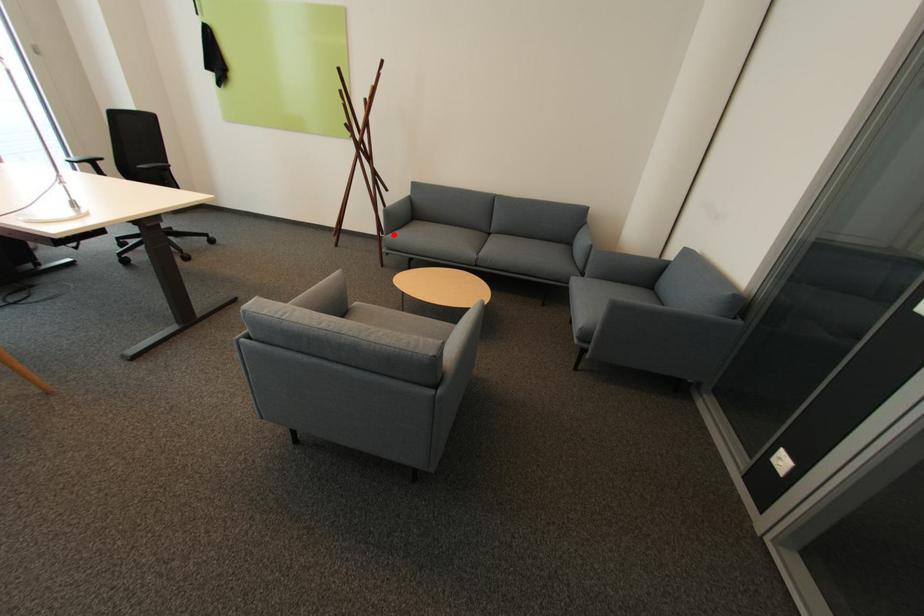
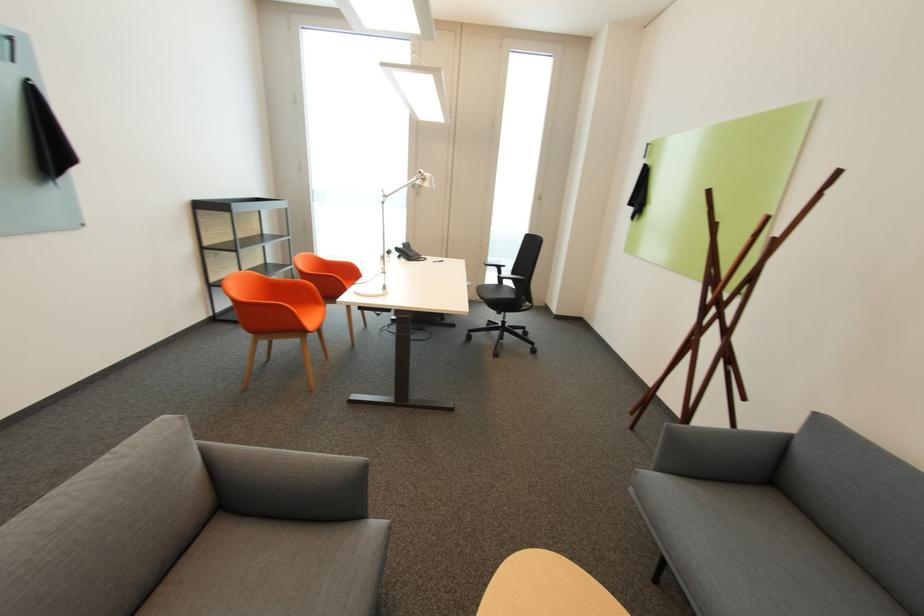
In the second image, find the point that corresponds to the highlighted location in the first image.

(663, 469)